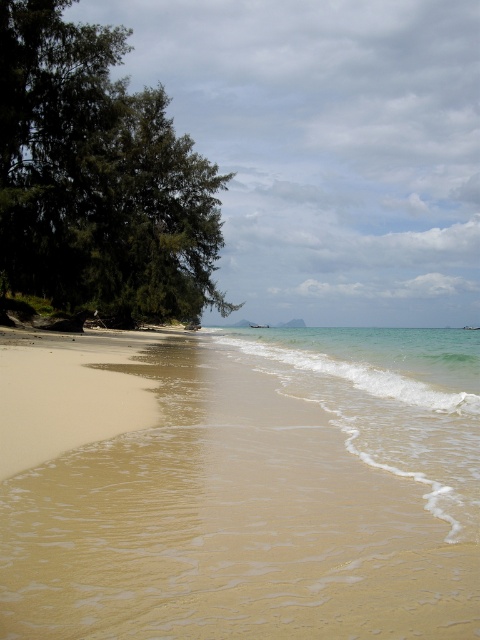
Can you confirm if sandy beach at lower left is smaller than clear water at lower right?

Correct, sandy beach at lower left occupies less space than clear water at lower right.

Is point (139, 529) less distant than point (386, 340)?

Yes, it is in front of point (386, 340).

Between point (40, 586) and point (342, 404), which one is positioned behind?

The point (342, 404) is behind.

The width and height of the screenshot is (480, 640). What are the coordinates of `sandy beach at lower left` in the screenshot? It's located at (264, 497).